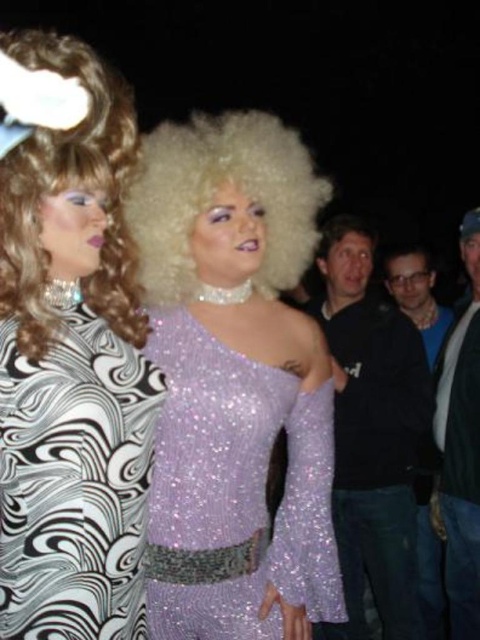
You are at a costume party and want to take a photo with both the dark blue sweater at right and the white curly wig at center. Since you want to ensure both are visible in the frame, which object should you position closer to the camera to maintain their visibility?

The dark blue sweater at right is taller than the white curly wig at center. To ensure both are visible in the frame, position the white curly wig at center closer to the camera since it is shorter, allowing it to be seen alongside the taller dark blue sweater at right.

You are organizing a clothing display and need to place the dark blue shirt at right and the denim jacket at right on a mannequin. The mannequin has limited space between its arms. If the minimum required space between items is 8 inches, will both items fit on the mannequin?

The dark blue shirt at right and denim jacket at right are 9.09 inches apart, which exceeds the minimum required space of 8 inches. Therefore, both items can fit on the mannequin.